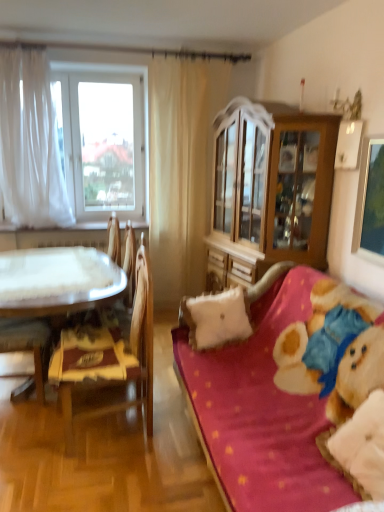
Question: From a real-world perspective, is white sheer curtain at left, the 2th curtain positioned from the right, physically located above or below metallic silver picture frame at upper right?

Choices:
 (A) above
 (B) below

Answer: (A)

Question: Would you say white sheer curtain at left, positioned as the first curtain in left-to-right order, is inside or outside metallic silver picture frame at upper right?

Choices:
 (A) inside
 (B) outside

Answer: (B)

Question: Which object is the closest to the beige fabric curtain at center, which is the 1th curtain from right to left?

Choices:
 (A) wooden cabinet at center
 (B) white sheer curtain at left, positioned as the first curtain in left-to-right order
 (C) velvet pink couch at right
 (D) wooden chair at left
 (E) white fluffy pillow at center, positioned as the 1th pillow in left-to-right order

Answer: (A)

Question: Based on their relative distances, which object is nearer to the white sheer curtain at left, the 2th curtain positioned from the right?

Choices:
 (A) white sheer curtain at left
 (B) wooden cabinet at center
 (C) white fluffy pillow at center, the second pillow from the right
 (D) wooden chair at left
 (E) velvet pink couch at right

Answer: (A)